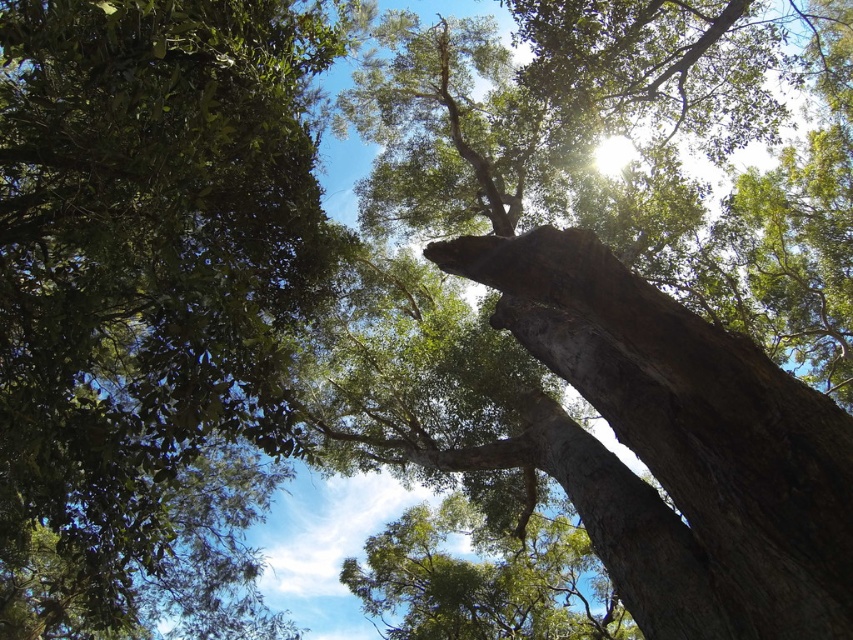
You are a bird trying to find a nesting spot. Which tree, the green leafy tree at upper left or the green rough bark tree at center, offers a wider canopy for building a nest?

The green leafy tree at upper left offers a wider canopy for building a nest since its width surpasses that of the green rough bark tree at center.

You are standing below the trees and looking up. Which tree is positioned more to your right side, the green leafy tree at upper left or the green rough bark tree at center?

The green leafy tree at upper left is positioned more to the right side compared to the green rough bark tree at center.

You are standing below the trees and looking up. Which tree is higher in the canopy between the green leafy tree at upper left and the green rough bark tree at center?

The green leafy tree at upper left is higher in the canopy than the green rough bark tree at center because it is located above it.